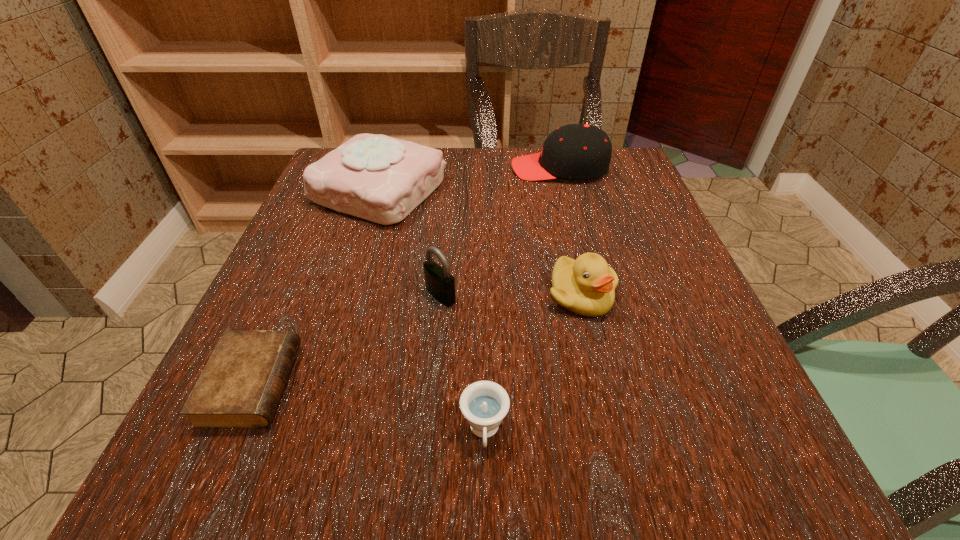
Locate an element on the screen. vacant space located on the right of the cake is located at coordinates (588, 190).

You are a GUI agent. You are given a task and a screenshot of the screen. Output one action in this format:
    pyautogui.click(x=<x>, y=<y>)
    Task: Click on the free space located 0.140m on the right of the padlock
    
    Given the screenshot: What is the action you would take?
    pyautogui.click(x=539, y=295)

Identify the location of free space located 0.250m on the front-facing side of the duckling. This screenshot has width=960, height=540. (624, 477).

You are a GUI agent. You are given a task and a screenshot of the screen. Output one action in this format:
    pyautogui.click(x=<x>, y=<y>)
    Task: Click on the free spot located 0.350m on the spine side of the diary
    The height and width of the screenshot is (540, 960).
    Given the screenshot: What is the action you would take?
    pyautogui.click(x=538, y=384)

Where is `cap that is at the far edge`? The height and width of the screenshot is (540, 960). cap that is at the far edge is located at coordinates (575, 151).

The width and height of the screenshot is (960, 540). Find the location of `cake situated at the far edge`. cake situated at the far edge is located at coordinates (378, 178).

You are a GUI agent. You are given a task and a screenshot of the screen. Output one action in this format:
    pyautogui.click(x=<x>, y=<y>)
    Task: Click on the object that is at the near edge
    The height and width of the screenshot is (540, 960).
    Given the screenshot: What is the action you would take?
    pyautogui.click(x=484, y=404)

Where is `cake at the left edge`? cake at the left edge is located at coordinates (378, 178).

Locate an element on the screen. The height and width of the screenshot is (540, 960). diary positioned at the left edge is located at coordinates (240, 387).

Find the location of `cap that is at the right edge`. cap that is at the right edge is located at coordinates (575, 151).